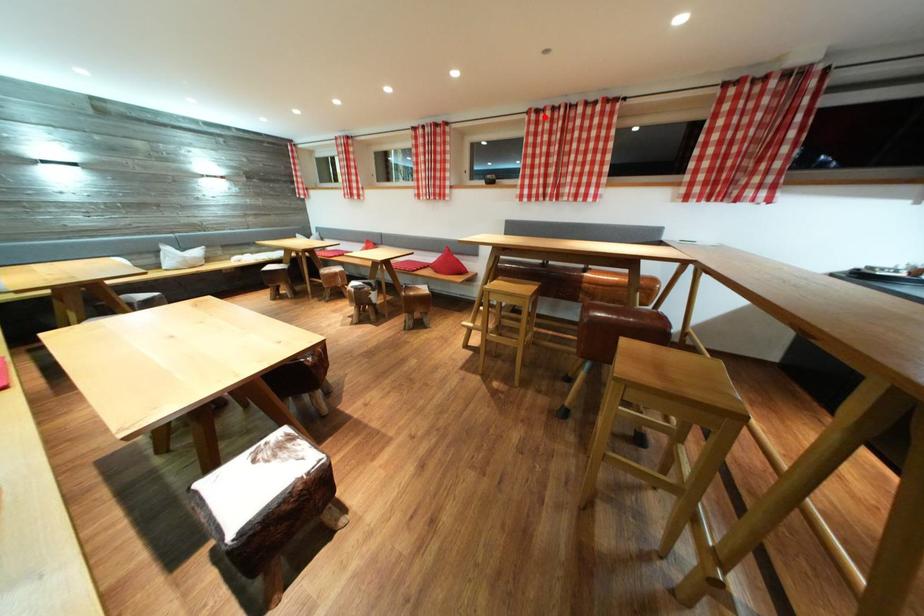
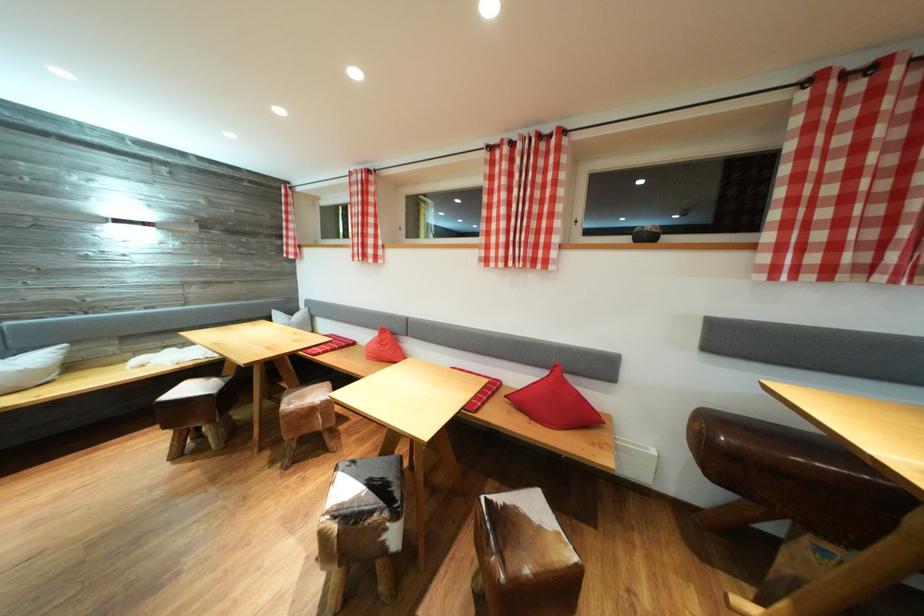
Question: I am providing you with two images of the same scene from different viewpoints. A red point is shown in image1. For the corresponding object point in image2, is it positioned nearer or farther from the camera?

Choices:
 (A) Nearer
 (B) Farther

Answer: (B)